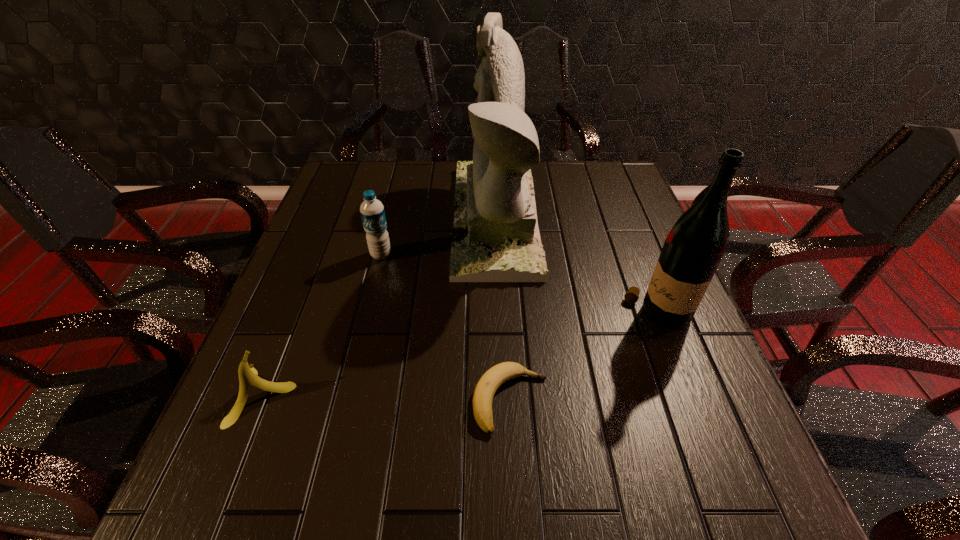
Where is `vacant area situated 0.390m on the base of the sculpture`? This screenshot has height=540, width=960. vacant area situated 0.390m on the base of the sculpture is located at coordinates (316, 218).

At what (x,y) coordinates should I click in order to perform the action: click on vacant area located on the base of the sculpture. Please return your answer as a coordinate pair (x, y). Looking at the image, I should click on (337, 218).

Image resolution: width=960 pixels, height=540 pixels. What are the coordinates of `free region located 0.110m on the surface of the wine bottle` in the screenshot? It's located at pyautogui.click(x=573, y=316).

At what (x,y) coordinates should I click in order to perform the action: click on vacant region located 0.200m on the surface of the wine bottle. Please return your answer as a coordinate pair (x, y). The image size is (960, 540). Looking at the image, I should click on (532, 316).

I want to click on vacant space located 0.360m on the surface of the wine bottle, so click(x=460, y=316).

Find the location of a particular element. This screenshot has width=960, height=540. vacant space located 0.330m on the label of the third shortest object is located at coordinates (351, 374).

Identify the location of vacant area located on the right of the leftmost object. (336, 395).

Where is `vacant space located 0.270m on the right of the right banana`? vacant space located 0.270m on the right of the right banana is located at coordinates (693, 401).

Locate an element on the screen. The width and height of the screenshot is (960, 540). object that is at the far edge is located at coordinates (495, 238).

The height and width of the screenshot is (540, 960). Identify the location of object located at the left edge. (247, 374).